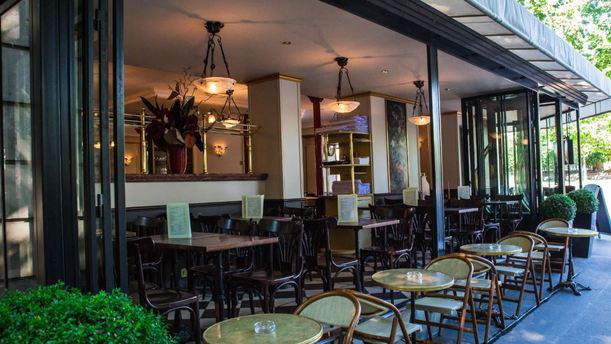
The width and height of the screenshot is (611, 344). In order to click on things that are on tables in this screenshot , I will do `click(271, 326)`, `click(414, 275)`, `click(497, 246)`, `click(579, 226)`, `click(464, 191)`, `click(411, 198)`, `click(349, 209)`, `click(258, 208)`, `click(181, 222)`.